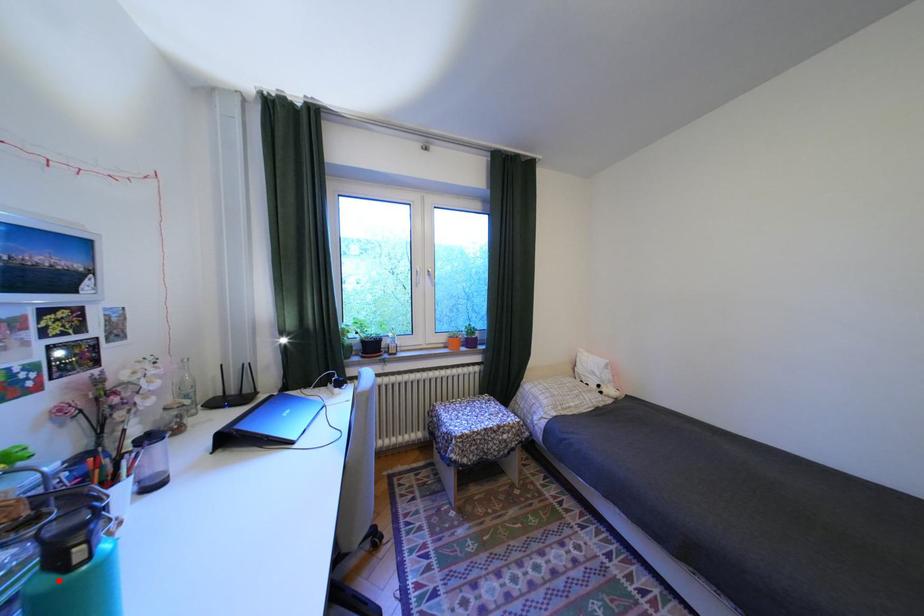
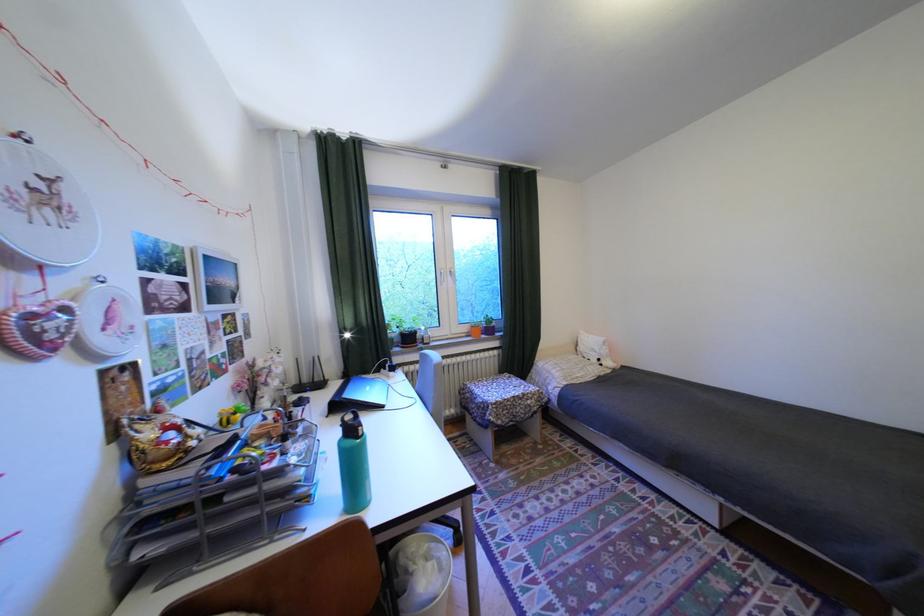
The point at the highlighted location is marked in the first image. Where is the corresponding point in the second image?

(361, 443)